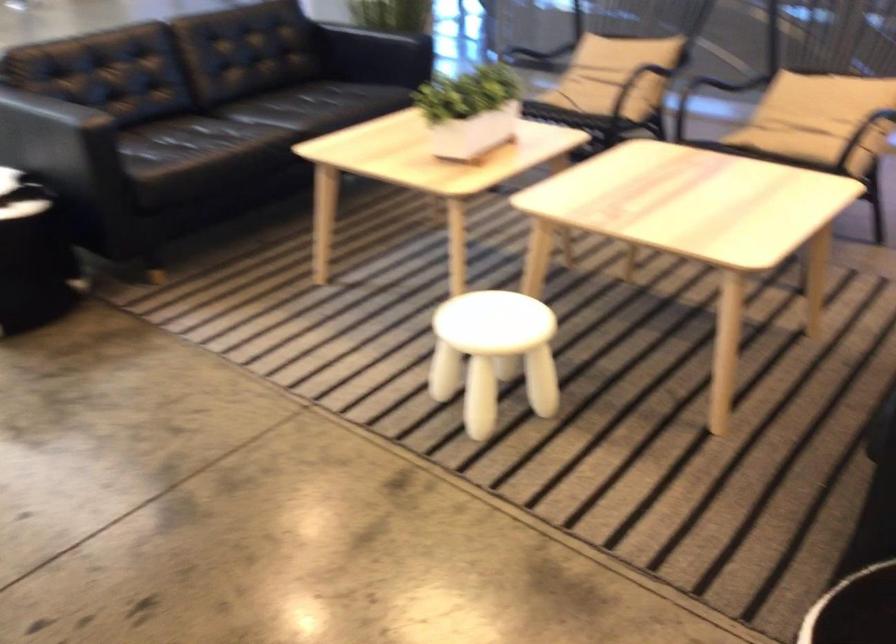
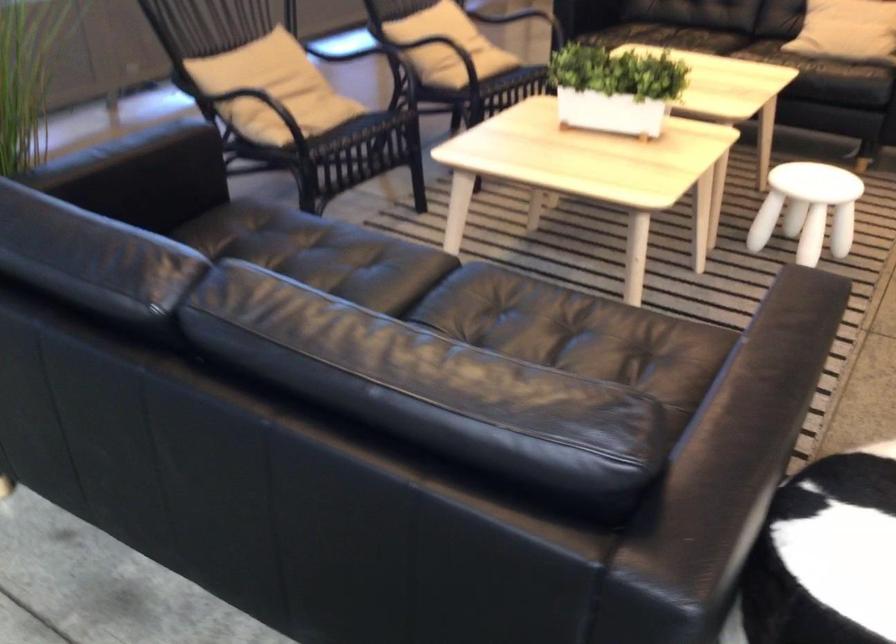
Where in the second image is the point corresponding to (776,93) from the first image?

(433, 43)